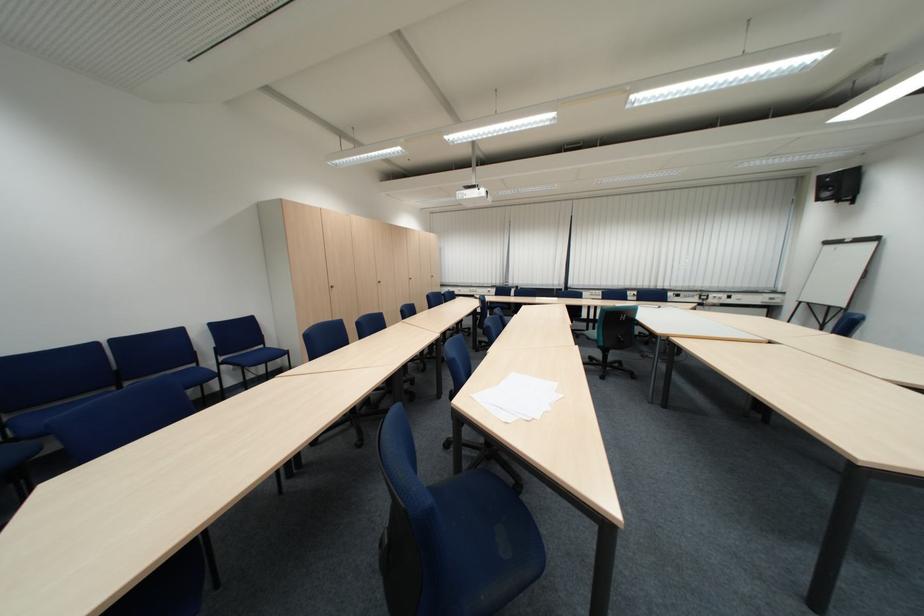
This screenshot has width=924, height=616. Find the location of `blinds control rod`. blinds control rod is located at coordinates tap(567, 253).